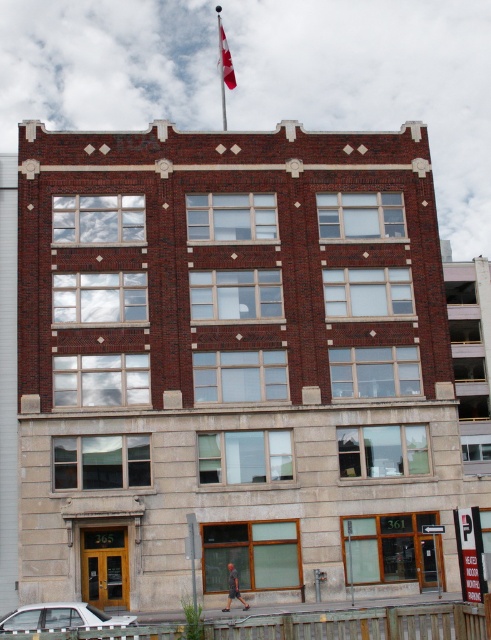
You are standing in front of the three story brick building and want to park your car. The parking spot you want is at point 0.966, 0.124. Is the white matte sedan at lower left blocking your parking spot?

The white matte sedan at lower left is located at point (60, 618), so yes, it is blocking your parking spot.

You are a delivery person approaching the building and notice a white matte sedan at lower left and a metallic flag pole at upper center. Which object is taller?

The metallic flag pole at upper center is taller than the white matte sedan at lower left.

You are standing in front of the three story brick building and want to determine the relative positions of two points on its facade. The first point is at coordinates point (225, 113) and the second is at point (226, 72). From your perspective, which point appears closer to you?

Point (226, 72) is closer to you because it is less further to the camera than point (225, 113).